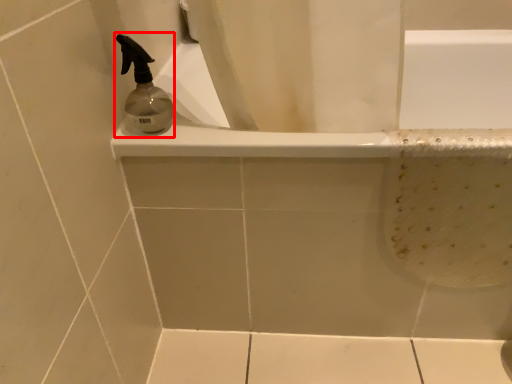
Question: In this image, where is soap dispenser (annotated by the red box) located relative to bathtub?

Choices:
 (A) right
 (B) left

Answer: (B)